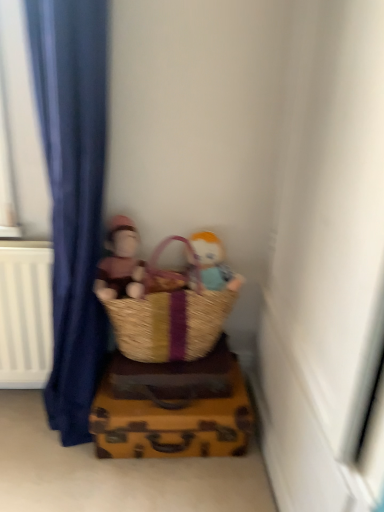
Question: Considering the relative sizes of brown woven picnic basket at lower center and brown woven basket at lower center in the image provided, is brown woven picnic basket at lower center wider than brown woven basket at lower center?

Choices:
 (A) no
 (B) yes

Answer: (A)

Question: From a real-world perspective, does brown woven picnic basket at lower center sit lower than brown woven basket at lower center?

Choices:
 (A) no
 (B) yes

Answer: (A)

Question: Considering the relative sizes of brown woven picnic basket at lower center and brown woven basket at lower center in the image provided, is brown woven picnic basket at lower center thinner than brown woven basket at lower center?

Choices:
 (A) yes
 (B) no

Answer: (A)

Question: Could you tell me if brown woven picnic basket at lower center is turned towards brown woven basket at lower center?

Choices:
 (A) no
 (B) yes

Answer: (A)

Question: From a real-world perspective, is brown woven picnic basket at lower center over brown woven basket at lower center?

Choices:
 (A) no
 (B) yes

Answer: (B)

Question: In terms of size, does matte plastic doll at center, arranged as the second person when viewed from the left, appear bigger or smaller than soft plush toy at center, arranged as the first person when viewed from the left?

Choices:
 (A) small
 (B) big

Answer: (A)

Question: Is matte plastic doll at center, the first person viewed from the right, wider or thinner than soft plush toy at center, the 2th person from the right?

Choices:
 (A) thin
 (B) wide

Answer: (A)

Question: From the image's perspective, is matte plastic doll at center, arranged as the second person when viewed from the left, located above or below soft plush toy at center, the 2th person from the right?

Choices:
 (A) above
 (B) below

Answer: (B)

Question: From a real-world perspective, relative to soft plush toy at center, arranged as the first person when viewed from the left, is matte plastic doll at center, the first person viewed from the right, vertically above or below?

Choices:
 (A) below
 (B) above

Answer: (A)

Question: Looking at the image, does brown woven picnic basket at lower center seem bigger or smaller compared to soft plush toy at center, the 2th person from the right?

Choices:
 (A) big
 (B) small

Answer: (A)

Question: Based on their positions, is brown woven picnic basket at lower center located to the left or right of soft plush toy at center, the 2th person from the right?

Choices:
 (A) left
 (B) right

Answer: (B)

Question: Considering the positions of point (220, 293) and point (114, 250), is point (220, 293) closer or farther from the camera than point (114, 250)?

Choices:
 (A) closer
 (B) farther

Answer: (B)

Question: Is brown woven picnic basket at lower center taller or shorter than soft plush toy at center, arranged as the first person when viewed from the left?

Choices:
 (A) short
 (B) tall

Answer: (B)

Question: Is point (187, 441) closer or farther from the camera than point (221, 305)?

Choices:
 (A) farther
 (B) closer

Answer: (B)

Question: From the image's perspective, is brown woven basket at lower center located above or below brown woven picnic basket at lower center?

Choices:
 (A) below
 (B) above

Answer: (A)